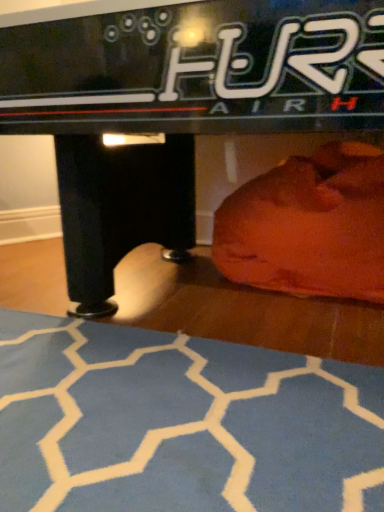
Question: Looking at the image, does blue textured yoga mat at lower center seem bigger or smaller compared to orange fabric bean bag at lower right?

Choices:
 (A) small
 (B) big

Answer: (A)

Question: Do you think blue textured yoga mat at lower center is within orange fabric bean bag at lower right, or outside of it?

Choices:
 (A) inside
 (B) outside

Answer: (B)

Question: Estimate the real-world distances between objects in this image. Which object is farther from the blue textured yoga mat at lower center?

Choices:
 (A) black glossy air hockey table at center
 (B) orange fabric bean bag at lower right

Answer: (B)

Question: Which object is positioned closest to the orange fabric bean bag at lower right?

Choices:
 (A) black glossy air hockey table at center
 (B) blue textured yoga mat at lower center

Answer: (A)